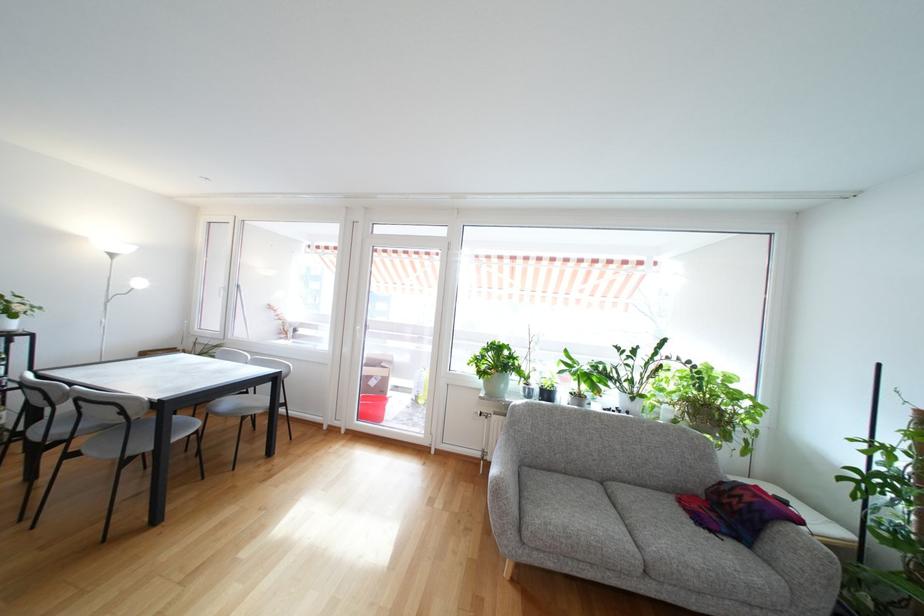
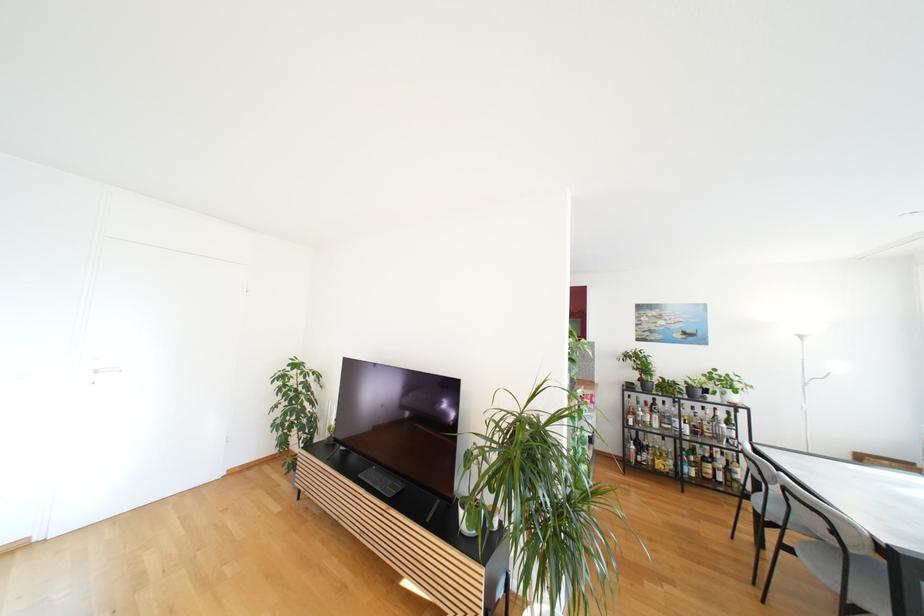
Question: Based on the continuous images, in which direction is the camera rotating? Reply with the corresponding letter.

Choices:
 (A) Left
 (B) Right
 (C) Up
 (D) Down

Answer: (A)